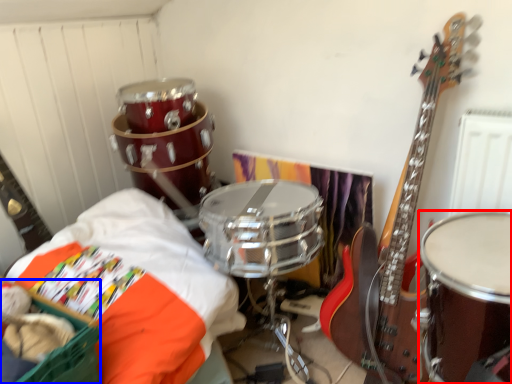
Question: Among these objects, which one is farthest to the camera, drum (highlighted by a red box) or basket (highlighted by a blue box)?

Choices:
 (A) drum
 (B) basket

Answer: (A)